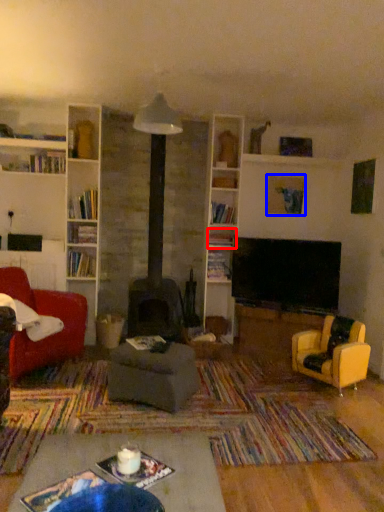
Question: Which object appears closest to the camera in this image, shelf (highlighted by a red box) or picture frame (highlighted by a blue box)?

Choices:
 (A) shelf
 (B) picture frame

Answer: (A)